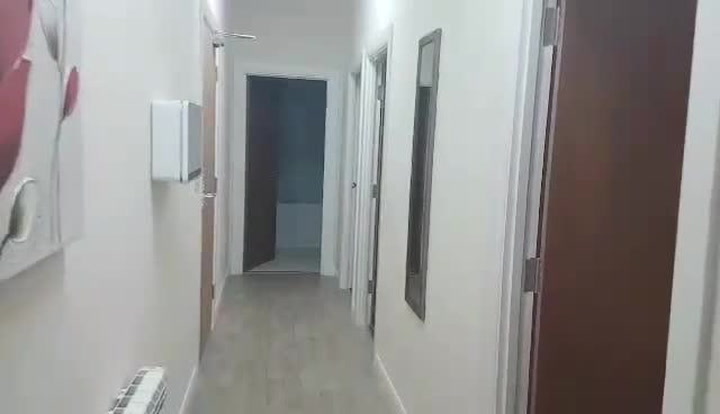
At what (x,y) coordinates should I click in order to perform the action: click on door. Please return your answer as a coordinate pair (x, y). The width and height of the screenshot is (720, 414). Looking at the image, I should click on (204, 253), (264, 177).